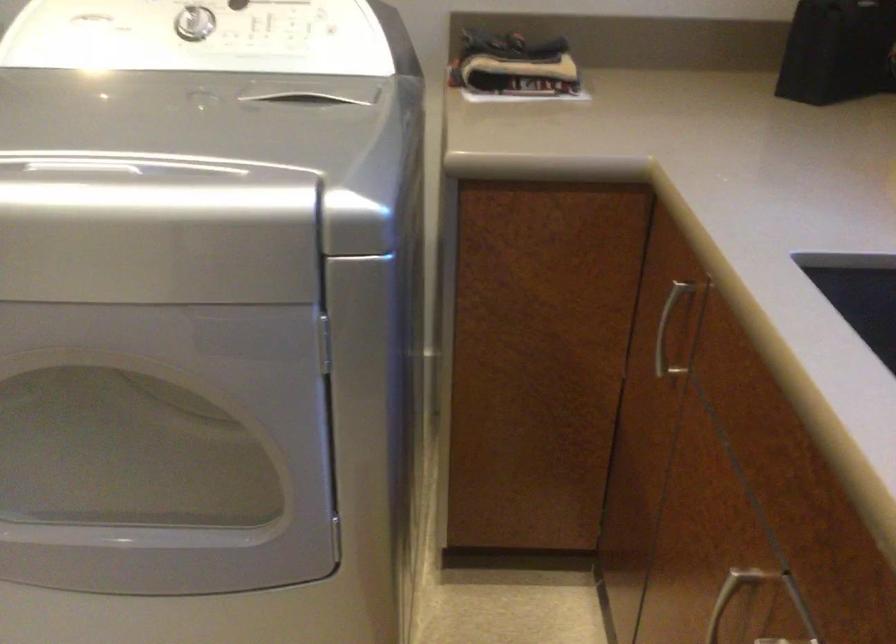
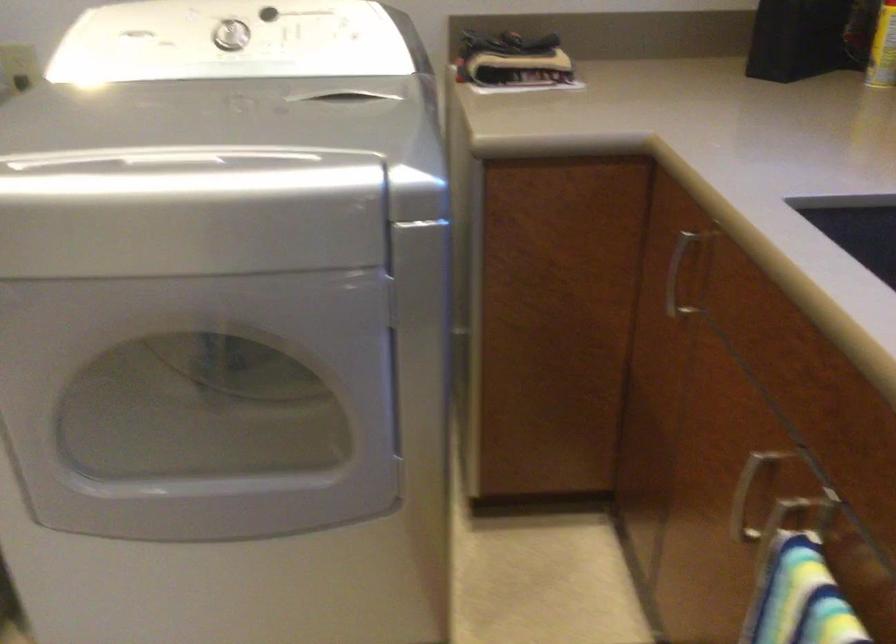
In the second image, find the point that corresponds to (670,326) in the first image.

(677, 275)